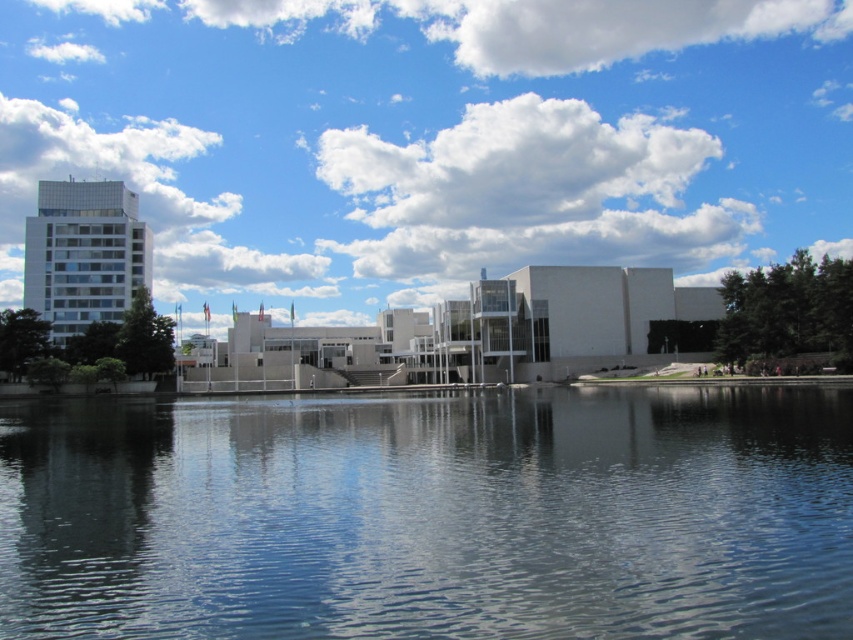
You are an urban planner analyzing the image. You need to determine which object takes up more area in the scene between the clear blue water at center and the white fluffy cloud at upper center. Based on the scene description, which one is larger?

The white fluffy cloud at upper center takes up more area than the clear blue water at center because the clear blue water at center occupies less space than the white fluffy cloud at upper center.

You are an architect analyzing the urban landscape. You notice the clear blue water at center and the white fluffy cloud at upper center. Which of these two elements has a lower height in the scene?

The clear blue water at center has a lesser height compared to the white fluffy cloud at upper center, so the clear blue water at center is lower in height.